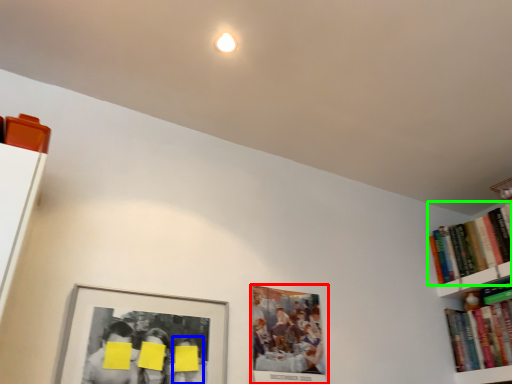
Question: Which object is the farthest from picture frame (highlighted by a red box)? Choose among these: person (highlighted by a blue box) or book (highlighted by a green box).

Choices:
 (A) person
 (B) book

Answer: (B)